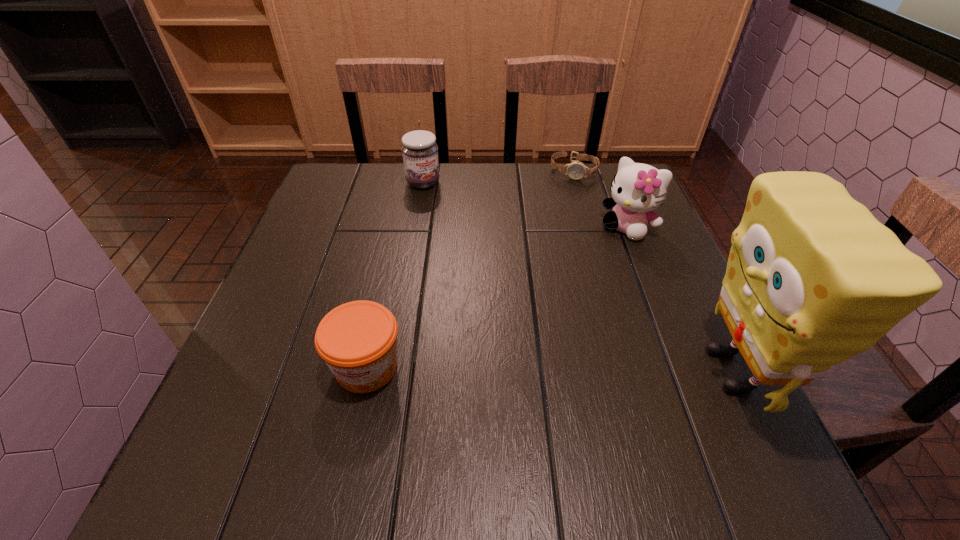
Where is `free location located 0.380m on the face of the tallest object`? free location located 0.380m on the face of the tallest object is located at coordinates (483, 370).

In order to click on vacant region located 0.060m on the face of the tallest object in this screenshot , I will do `click(659, 370)`.

Locate an element on the screen. The image size is (960, 540). vacant space located on the front-facing side of the kitten is located at coordinates (583, 279).

At what (x,y) coordinates should I click in order to perform the action: click on vacant space located on the front-facing side of the kitten. Please return your answer as a coordinate pair (x, y). The height and width of the screenshot is (540, 960). Looking at the image, I should click on (540, 329).

This screenshot has height=540, width=960. What are the coordinates of `free location located on the front-facing side of the kitten` in the screenshot? It's located at point(529,342).

At what (x,y) coordinates should I click in order to perform the action: click on blank space located 0.350m on the face of the watch. Please return your answer as a coordinate pair (x, y). The image size is (960, 540). Looking at the image, I should click on (552, 260).

Where is `free region located 0.220m on the face of the watch`? free region located 0.220m on the face of the watch is located at coordinates (560, 227).

Identify the location of vacant area situated on the face of the watch. (562, 220).

Where is `free space located 0.370m on the front label of the farther jam`? free space located 0.370m on the front label of the farther jam is located at coordinates (502, 269).

The width and height of the screenshot is (960, 540). Find the location of `vacant area situated 0.170m on the front label of the farther jam`. vacant area situated 0.170m on the front label of the farther jam is located at coordinates (460, 223).